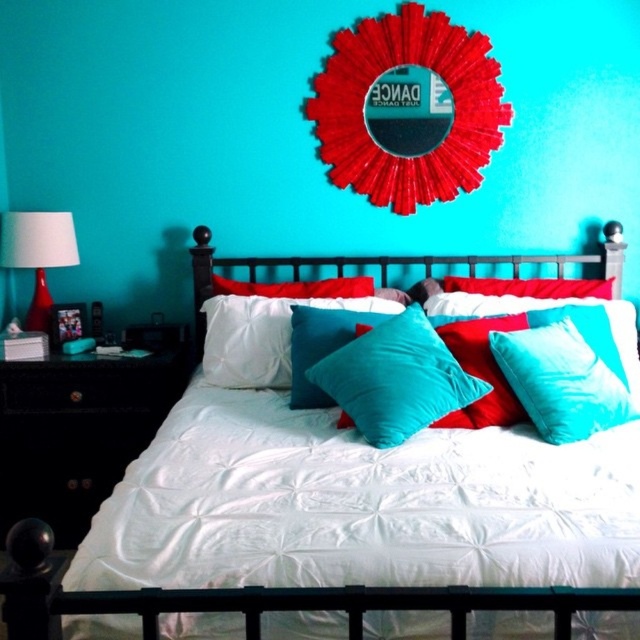
Question: Is teal velvet pillows at center positioned before matte red glass lamp at left?

Choices:
 (A) yes
 (B) no

Answer: (B)

Question: Which object is positioned closest to the teal soft pillow at center?

Choices:
 (A) black glossy dresser at left
 (B) teal velvet pillow at center

Answer: (B)

Question: Can you confirm if black glossy dresser at left is wider than matte red glass lamp at left?

Choices:
 (A) yes
 (B) no

Answer: (A)

Question: Which of these objects is positioned farthest from the teal soft cushion at center?

Choices:
 (A) teal soft pillow at center
 (B) black glossy dresser at left
 (C) teal velvet pillow at center

Answer: (B)

Question: Does teal velvet pillow at center appear over matte red glass lamp at left?

Choices:
 (A) no
 (B) yes

Answer: (A)

Question: Which point is closer to the camera taking this photo?

Choices:
 (A) (579, 387)
 (B) (400, 310)
 (C) (493, 595)
 (D) (90, 445)

Answer: (C)